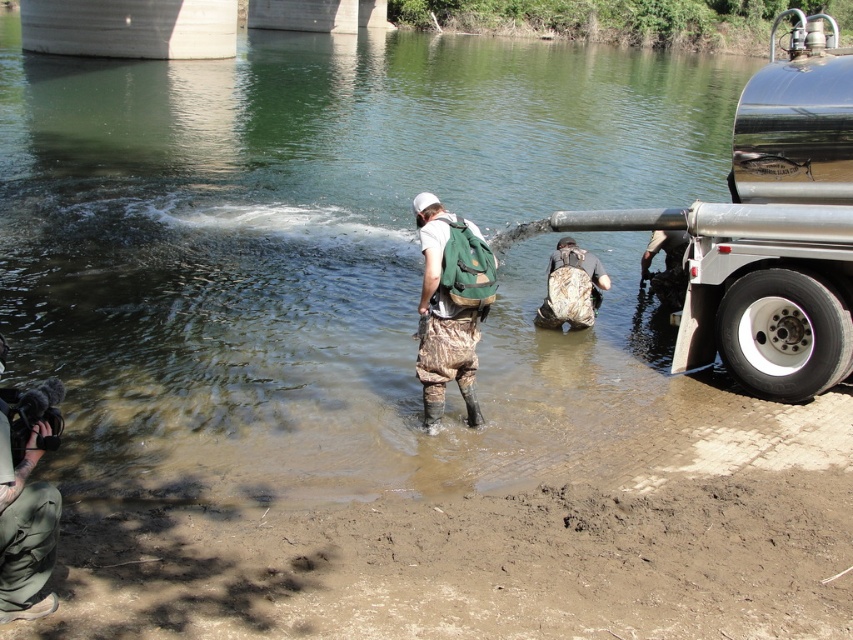
Who is positioned more to the right, camouflage pants at center or camouflage fabric backpack at center?

camouflage fabric backpack at center is more to the right.

At what (x,y) coordinates should I click in order to perform the action: click on camouflage pants at center. Please return your answer as a coordinate pair (x, y). Looking at the image, I should click on (450, 305).

Image resolution: width=853 pixels, height=640 pixels. Find the location of `camouflage pants at center`. camouflage pants at center is located at coordinates (450, 305).

What are the coordinates of `camouflage pants at center` in the screenshot? It's located at (450, 305).

Does brown muddy ground at lower left have a greater height compared to camouflage pants at center?

Incorrect, brown muddy ground at lower left's height is not larger of camouflage pants at center's.

Can you confirm if brown muddy ground at lower left is positioned to the left of camouflage pants at center?

Incorrect, brown muddy ground at lower left is not on the left side of camouflage pants at center.

Where is `brown muddy ground at lower left`? This screenshot has height=640, width=853. brown muddy ground at lower left is located at coordinates (473, 564).

This screenshot has width=853, height=640. I want to click on brown muddy ground at lower left, so click(x=473, y=564).

Which is above, shiny metallic trailer truck at right or camouflage fabric backpack at center?

Positioned higher is shiny metallic trailer truck at right.

Can you confirm if shiny metallic trailer truck at right is wider than camouflage fabric backpack at center?

Yes, shiny metallic trailer truck at right is wider than camouflage fabric backpack at center.

Find the location of a particular element. The image size is (853, 640). shiny metallic trailer truck at right is located at coordinates (770, 228).

Find the location of a particular element. This screenshot has height=640, width=853. shiny metallic trailer truck at right is located at coordinates (770, 228).